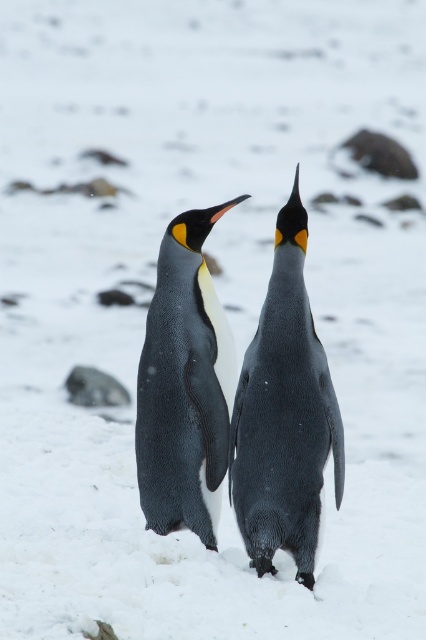
Consider the image. Does black matte penguin at center lie in front of black glossy penguin at center?

Yes, it is.

Find the location of a particular element. The image size is (426, 640). black matte penguin at center is located at coordinates pos(284,416).